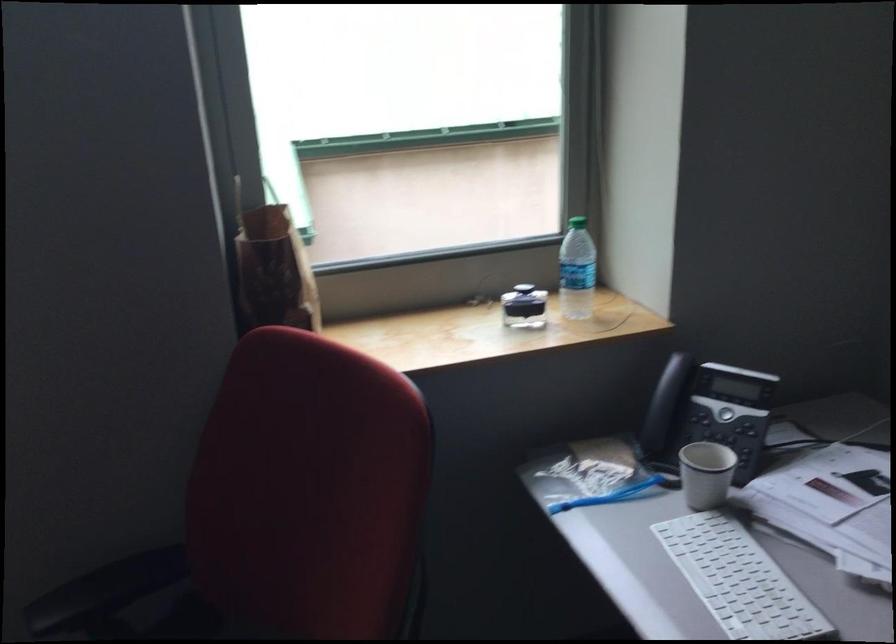
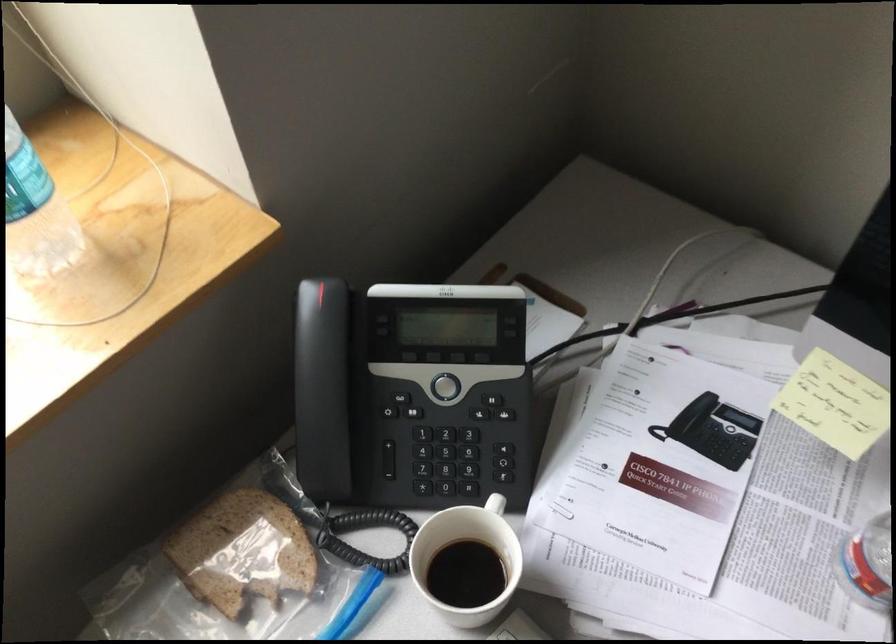
The images are taken continuously from a first-person perspective. In which direction is your viewpoint rotating?

The rotation direction of the camera is right-down.